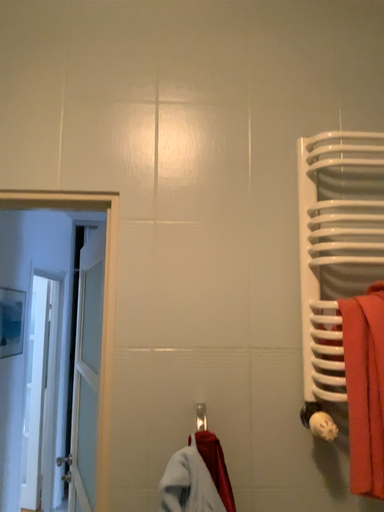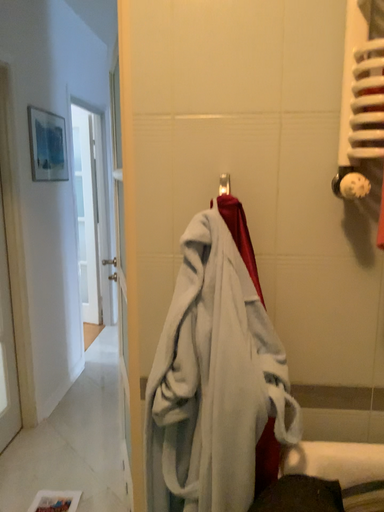
Question: How did the camera likely rotate when shooting the video?

Choices:
 (A) rotated downward
 (B) rotated upward

Answer: (A)